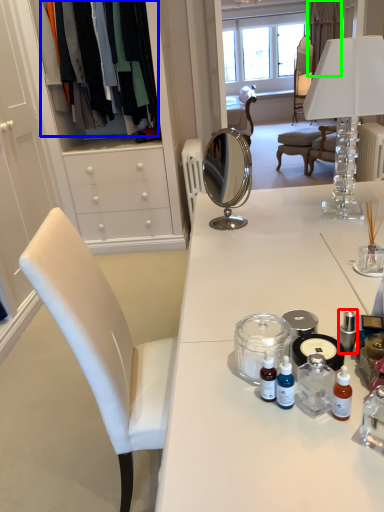
Question: Which object is positioned closest to toiletry (highlighted by a red box)? Select from clothing (highlighted by a blue box) and curtain (highlighted by a green box).

Choices:
 (A) clothing
 (B) curtain

Answer: (A)